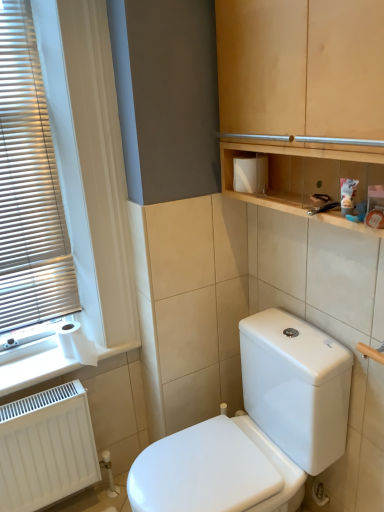
Question: Considering the relative positions of white glossy toilet at center and white matte toilet paper at lower left in the image provided, is white glossy toilet at center to the right of white matte toilet paper at lower left from the viewer's perspective?

Choices:
 (A) yes
 (B) no

Answer: (A)

Question: Is white matte toilet paper at lower left inside white glossy toilet at center?

Choices:
 (A) yes
 (B) no

Answer: (B)

Question: Are white glossy toilet at center and white matte toilet paper at lower left far apart?

Choices:
 (A) yes
 (B) no

Answer: (B)

Question: Can you confirm if white glossy toilet at center is smaller than white matte toilet paper at lower left?

Choices:
 (A) yes
 (B) no

Answer: (B)

Question: Is white glossy toilet at center outside white matte toilet paper at lower left?

Choices:
 (A) yes
 (B) no

Answer: (A)

Question: Considering the positions of white plastic blinds at left and white matte radiator at lower left in the image, is white plastic blinds at left taller or shorter than white matte radiator at lower left?

Choices:
 (A) tall
 (B) short

Answer: (A)

Question: Would you say white plastic blinds at left is to the left or to the right of white matte radiator at lower left in the picture?

Choices:
 (A) left
 (B) right

Answer: (A)

Question: Considering the positions of white plastic blinds at left and white matte radiator at lower left in the image, is white plastic blinds at left wider or thinner than white matte radiator at lower left?

Choices:
 (A) thin
 (B) wide

Answer: (A)

Question: From the image's perspective, relative to white matte radiator at lower left, is white plastic blinds at left above or below?

Choices:
 (A) below
 (B) above

Answer: (B)

Question: Looking at the image, does wooden cabinet at upper center seem bigger or smaller compared to white matte toilet paper at lower left?

Choices:
 (A) small
 (B) big

Answer: (B)

Question: From their relative heights in the image, would you say wooden cabinet at upper center is taller or shorter than white matte toilet paper at lower left?

Choices:
 (A) short
 (B) tall

Answer: (B)

Question: From a real-world perspective, relative to white matte toilet paper at lower left, is wooden cabinet at upper center vertically above or below?

Choices:
 (A) below
 (B) above

Answer: (B)

Question: Based on their positions, is wooden cabinet at upper center located to the left or right of white matte toilet paper at lower left?

Choices:
 (A) right
 (B) left

Answer: (A)

Question: Relative to white paper at lower left, is wooden cabinet at upper center in front or behind?

Choices:
 (A) behind
 (B) front

Answer: (B)

Question: Considering the positions of wooden cabinet at upper center and white paper at lower left in the image, is wooden cabinet at upper center taller or shorter than white paper at lower left?

Choices:
 (A) short
 (B) tall

Answer: (B)